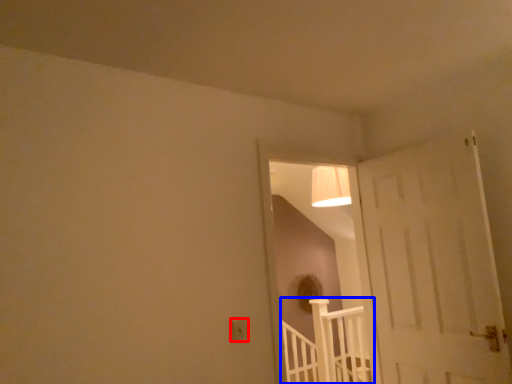
Question: Among these objects, which one is farthest to the camera, electric outlet (highlighted by a red box) or rail (highlighted by a blue box)?

Choices:
 (A) electric outlet
 (B) rail

Answer: (B)